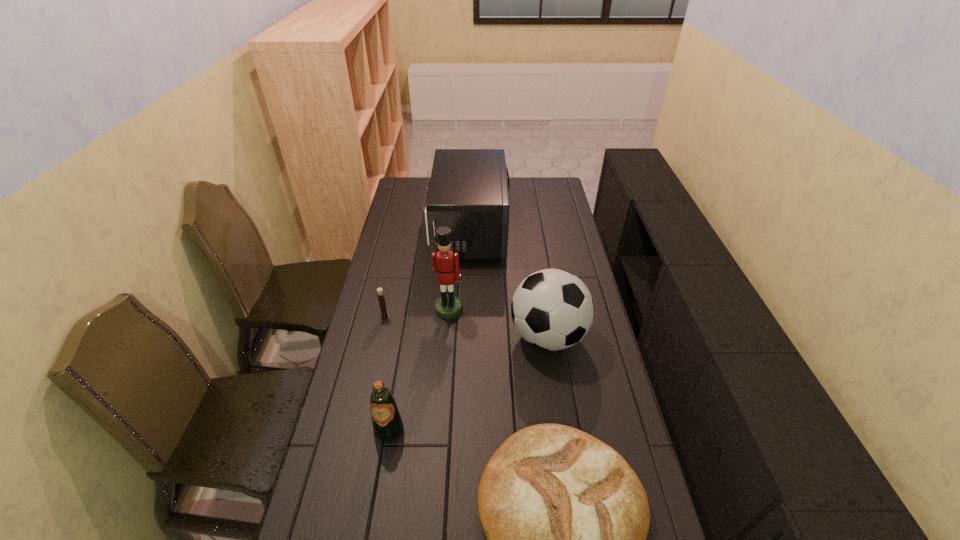
Find the location of a particular element. The width and height of the screenshot is (960, 540). nutcracker is located at coordinates (449, 306).

At what (x,y) coordinates should I click in order to perform the action: click on microwave oven. Please return your answer as a coordinate pair (x, y). This screenshot has width=960, height=540. Looking at the image, I should click on (468, 192).

Locate an element on the screen. soccer ball is located at coordinates (552, 309).

In order to click on the fifth object from right to left in this screenshot , I will do `click(387, 424)`.

Locate an element on the screen. This screenshot has width=960, height=540. the fourth tallest object is located at coordinates (387, 424).

Where is `the leftmost object`? This screenshot has height=540, width=960. the leftmost object is located at coordinates (380, 293).

The image size is (960, 540). Find the location of `vacant region located on the front-facing side of the tallest object`. vacant region located on the front-facing side of the tallest object is located at coordinates (443, 393).

In order to click on free space located on the front-facing side of the microwave oven in this screenshot , I will do `click(546, 230)`.

This screenshot has width=960, height=540. Find the location of `free spot located on the front of the soccer ball`. free spot located on the front of the soccer ball is located at coordinates (568, 470).

At what (x,y) coordinates should I click in order to perform the action: click on free spot located 0.160m on the front-facing side of the fifth object from right to left. Please return your answer as a coordinate pair (x, y). Looking at the image, I should click on (376, 502).